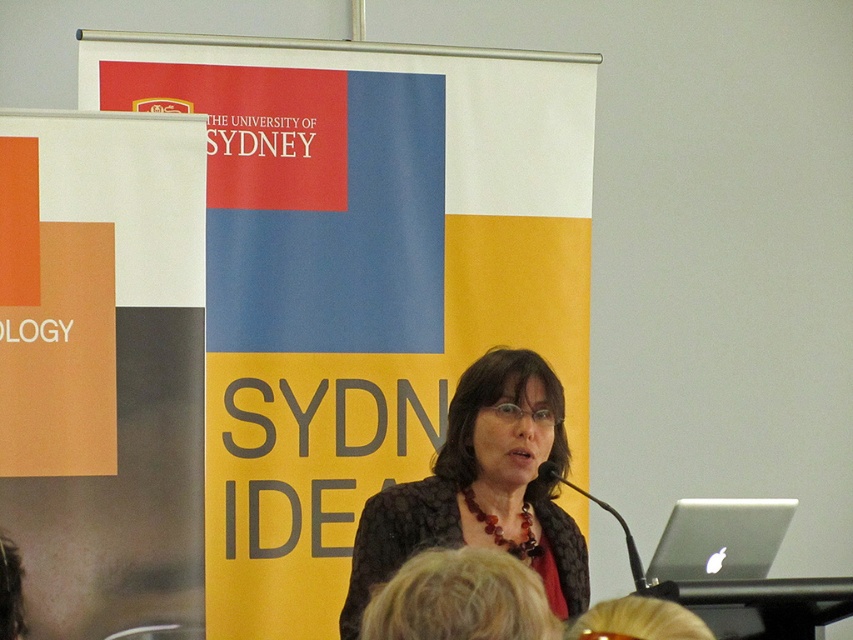
You are organizing an event and need to determine which promotional material to prioritize for visibility. Given the scene, which object between the matte plastic banner at center and the orange matte poster at left should you focus on, and why?

The matte plastic banner at center is larger in size than the orange matte poster at left, so it should be prioritized for visibility because its larger size makes it more noticeable to the audience.

You are a photographer adjusting your camera settings. You notice two points in the image at coordinates point (280, 216) and point (183, 444). Based on their positions, which point is closer to your camera lens?

Point (183, 444) is closer to the camera lens because it is positioned nearer than point (280, 216), which is further away.

You are organizing an event and need to place a new sign between the orange matte poster at left and the silver metallic laptop at lower right. Based on their positions, which object should the sign be closer to?

The sign should be placed closer to the silver metallic laptop at lower right because the orange matte poster at left is positioned to the left of the silver metallic laptop at lower right, meaning the laptop is to the right of the poster. Therefore, placing the sign closer to the laptop would be between them.